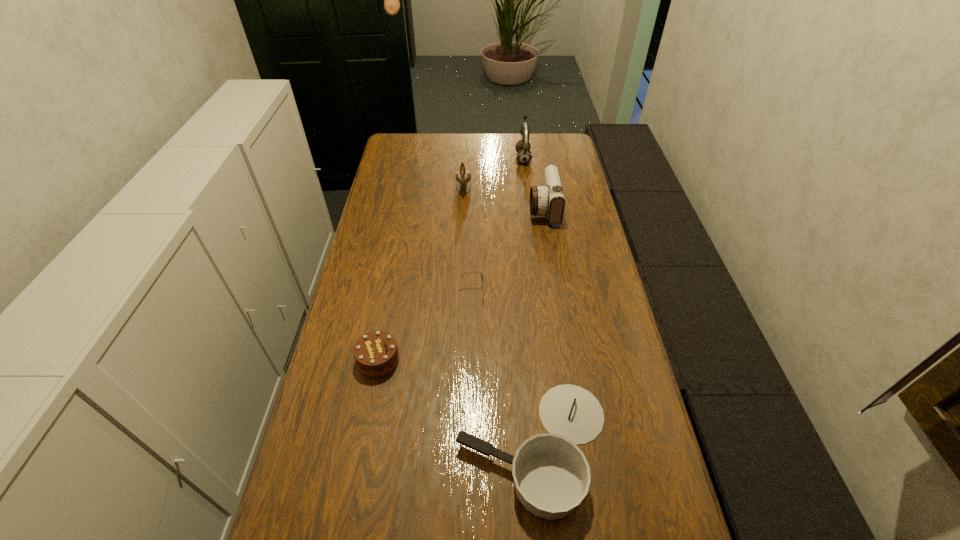
This screenshot has height=540, width=960. I want to click on the tallest object, so click(x=524, y=156).

Find the location of a particular element. The width and height of the screenshot is (960, 540). the farthest object is located at coordinates (524, 156).

Where is `bird`? This screenshot has width=960, height=540. bird is located at coordinates (463, 177).

Where is `camcorder`? camcorder is located at coordinates (548, 199).

Identify the location of chocolate cake. This screenshot has height=540, width=960. (376, 353).

What are the coordinates of `the leftmost object` in the screenshot? It's located at (376, 353).

Find the location of a particular element. This screenshot has width=960, height=540. sunglasses is located at coordinates (470, 272).

You are a GUI agent. You are given a task and a screenshot of the screen. Output one action in this format:
    pyautogui.click(x=<x>, y=<y>)
    Task: Click on the saucepan
    This screenshot has width=960, height=540.
    Given the screenshot: What is the action you would take?
    pyautogui.click(x=551, y=474)

Find the location of a particular element. The height and width of the screenshot is (540, 960). free space located on the ear pads of the farthest object is located at coordinates (467, 158).

You are a GUI agent. You are given a task and a screenshot of the screen. Output one action in this format:
    pyautogui.click(x=<x>, y=<y>)
    Task: Click on the vacant space located on the ear pads of the farthest object
    The image size is (960, 540).
    Given the screenshot: What is the action you would take?
    pyautogui.click(x=496, y=158)